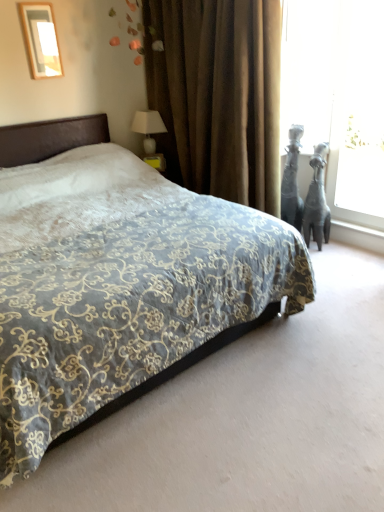
You are a GUI agent. You are given a task and a screenshot of the screen. Output one action in this format:
    pyautogui.click(x=<x>, y=<y>)
    Task: Click on the free region under transparent glass window screen at right (from a real-world perspective)
    This screenshot has width=384, height=512.
    Given the screenshot: What is the action you would take?
    pyautogui.click(x=353, y=226)